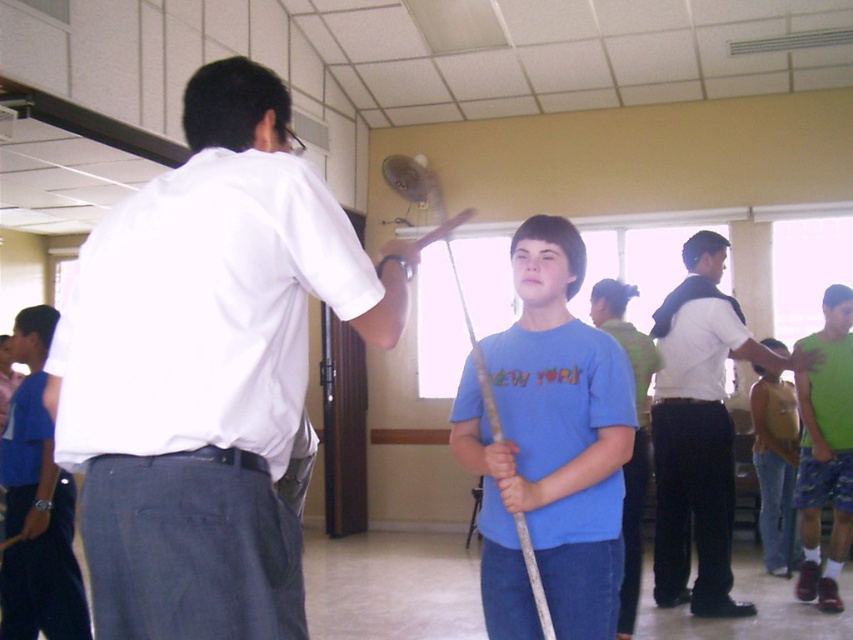
Question: Is white smooth shirt at center in front of brown leather backpack at center?

Choices:
 (A) no
 (B) yes

Answer: (B)

Question: Is white smooth shirt at center thinner than blue cotton shirt at center?

Choices:
 (A) yes
 (B) no

Answer: (B)

Question: Is white smooth shirt at center positioned behind blue cotton shirt at center?

Choices:
 (A) yes
 (B) no

Answer: (B)

Question: Estimate the real-world distances between objects in this image. Which object is closer to the brown leather backpack at center?

Choices:
 (A) white smooth shirt at center
 (B) blue cotton shirt at center

Answer: (B)

Question: Which of the following is the closest to the observer?

Choices:
 (A) (178, 544)
 (B) (776, 452)
 (C) (543, 257)

Answer: (A)

Question: Which object is closer to the camera taking this photo?

Choices:
 (A) brown leather backpack at center
 (B) blue cotton shirt at center
 (C) white shirt at right

Answer: (B)